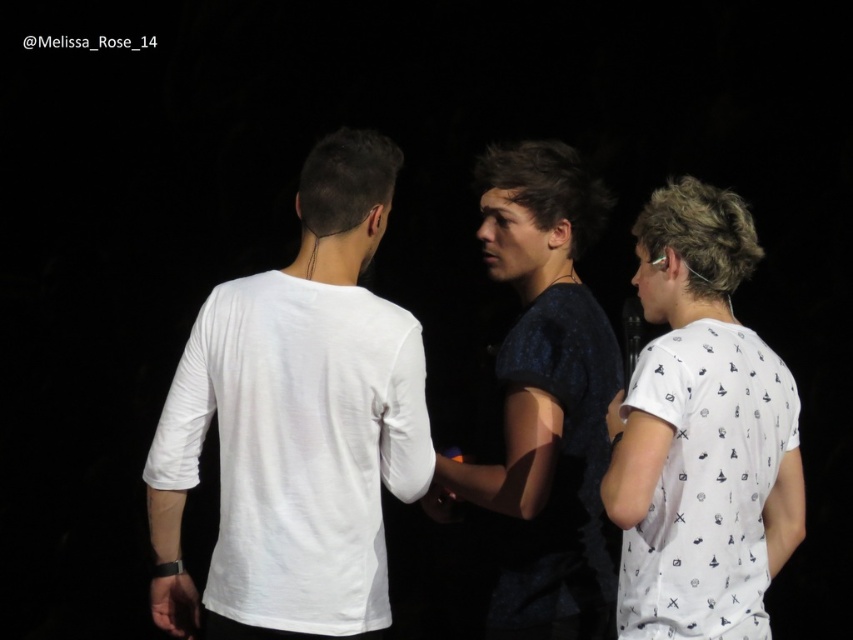
Question: Which point is farther to the camera?

Choices:
 (A) (489, 172)
 (B) (508, 180)

Answer: (A)

Question: Is white matte t-shirt at center positioned behind dark blue textured shirt at center?

Choices:
 (A) no
 (B) yes

Answer: (A)

Question: Estimate the real-world distances between objects in this image. Which object is closer to the white cotton t-shirt at center?

Choices:
 (A) white matte t-shirt at center
 (B) white printed t-shirt at right
 (C) dark blue textured shirt at center

Answer: (A)

Question: Among these points, which one is farthest from the camera?

Choices:
 (A) (682, 328)
 (B) (515, 204)

Answer: (B)

Question: Can you confirm if white matte t-shirt at center is positioned to the left of white printed t-shirt at right?

Choices:
 (A) yes
 (B) no

Answer: (A)

Question: Is white matte t-shirt at center wider than dark blue textured shirt at center?

Choices:
 (A) no
 (B) yes

Answer: (B)